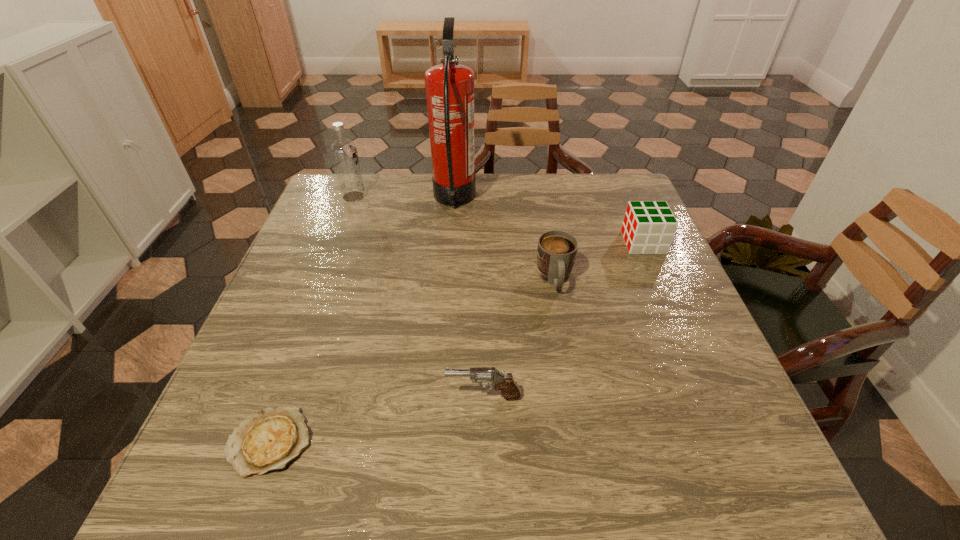
Find the location of a particular element. The image size is (960, 540). vodka present at the far edge is located at coordinates (343, 151).

This screenshot has height=540, width=960. I want to click on object located at the near edge, so click(268, 441).

This screenshot has height=540, width=960. What are the coordinates of `vodka that is positioned at the left edge` in the screenshot? It's located at (343, 151).

Image resolution: width=960 pixels, height=540 pixels. Identify the location of quiche at the left edge. (268, 441).

Identify the location of object at the right edge. This screenshot has height=540, width=960. (648, 227).

Identify the location of object situated at the far left corner. (343, 151).

Where is `object that is at the near left corner`? The height and width of the screenshot is (540, 960). object that is at the near left corner is located at coordinates (268, 441).

This screenshot has width=960, height=540. In the image, there is a desktop. What are the coordinates of `vacant space at the far edge` in the screenshot? It's located at (483, 173).

I want to click on blank space at the near edge of the desktop, so click(312, 498).

Where is `free location at the left edge of the desktop`? The width and height of the screenshot is (960, 540). free location at the left edge of the desktop is located at coordinates click(287, 338).